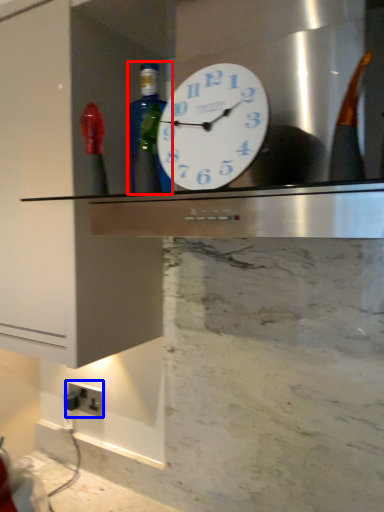
Question: Which point is closer to the camera, bottle (highlighted by a red box) or electric outlet (highlighted by a blue box)?

Choices:
 (A) bottle
 (B) electric outlet

Answer: (A)